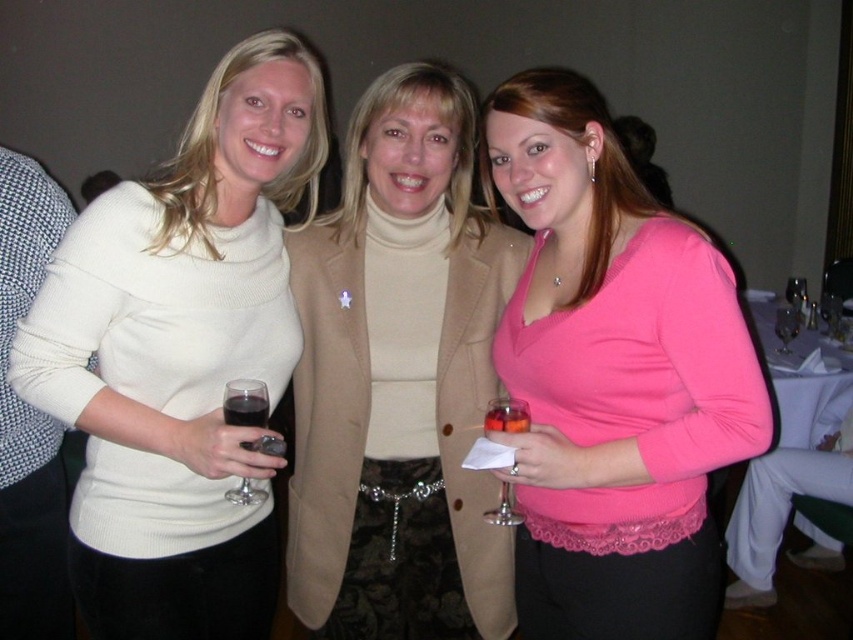
Question: Which point appears farthest from the camera in this image?

Choices:
 (A) (241, 493)
 (B) (622, 579)
 (C) (527, 410)

Answer: (B)

Question: Estimate the real-world distances between objects in this image. Which object is closer to the beige turtleneck sweater at center?

Choices:
 (A) transparent plastic wine glass at center
 (B) pink matte sweater at center

Answer: (B)

Question: Can you confirm if white knit sweater at left is thinner than transparent plastic wine glass at center?

Choices:
 (A) yes
 (B) no

Answer: (B)

Question: Can you confirm if matte glass wine at left is bigger than translucent glass wine at center?

Choices:
 (A) yes
 (B) no

Answer: (A)

Question: Can you confirm if pink matte sweater at center is thinner than transparent plastic wine glass at center?

Choices:
 (A) no
 (B) yes

Answer: (A)

Question: Which object is farther from the camera taking this photo?

Choices:
 (A) translucent glass wine glass at center
 (B) beige turtleneck sweater at center

Answer: (B)